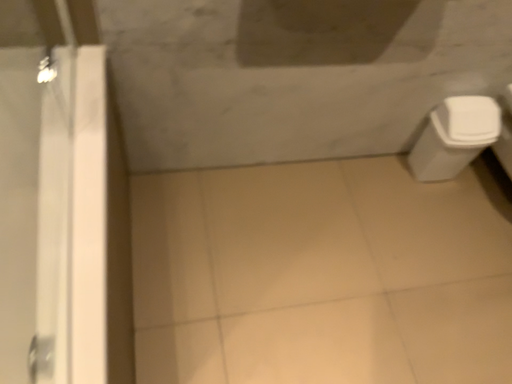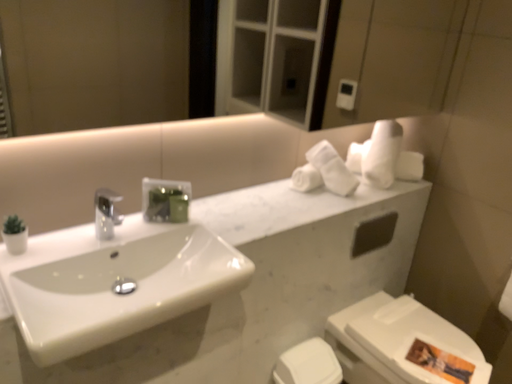
Question: Which way did the camera rotate in the video?

Choices:
 (A) rotated upward
 (B) rotated downward

Answer: (A)